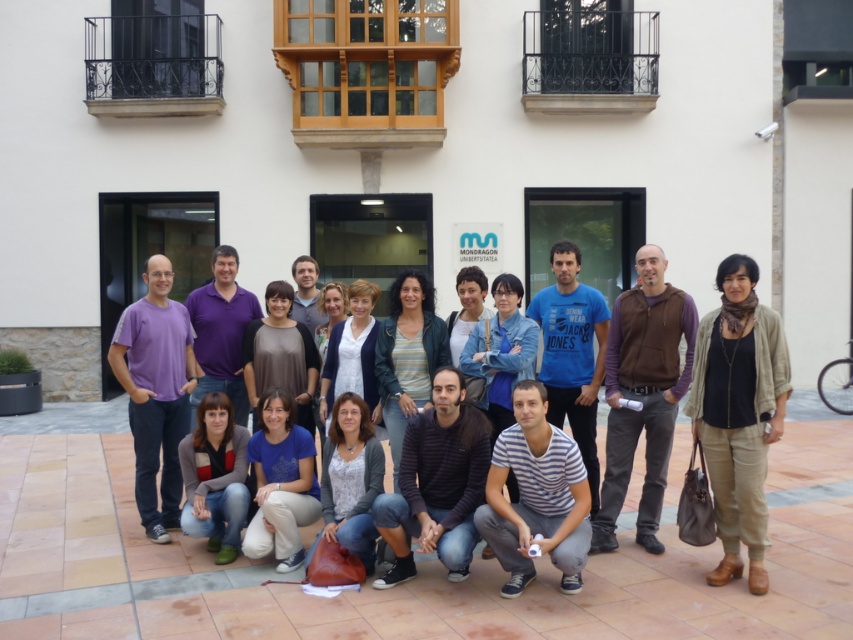
Question: Which point is farther to the camera?

Choices:
 (A) (225, 422)
 (B) (408, 317)
 (C) (196, 339)
 (D) (567, 348)

Answer: (C)

Question: Which is farther from the light blue shirt at center?

Choices:
 (A) striped knit sweater at center
 (B) purple cotton polo shirt at center
 (C) white matte jacket at center

Answer: (A)

Question: Is blue cotton t-shirt at center behind striped knit sweater at center?

Choices:
 (A) no
 (B) yes

Answer: (B)

Question: Which point is farther to the camera?

Choices:
 (A) purple cotton polo shirt at center
 (B) brown cotton vest at center-right
 (C) khaki cotton pants at lower right

Answer: (A)

Question: Considering the relative positions of khaki cotton pants at lower right and denim jeans at lower left in the image provided, where is khaki cotton pants at lower right located with respect to denim jeans at lower left?

Choices:
 (A) right
 (B) left

Answer: (A)

Question: Does purple cotton t-shirt at left have a lesser width compared to blue cotton t-shirt at center?

Choices:
 (A) yes
 (B) no

Answer: (B)